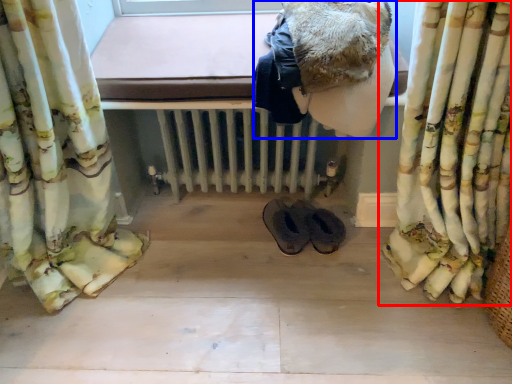
Question: Which point is further to the camera, curtain (highlighted by a red box) or clothing (highlighted by a blue box)?

Choices:
 (A) curtain
 (B) clothing

Answer: (B)